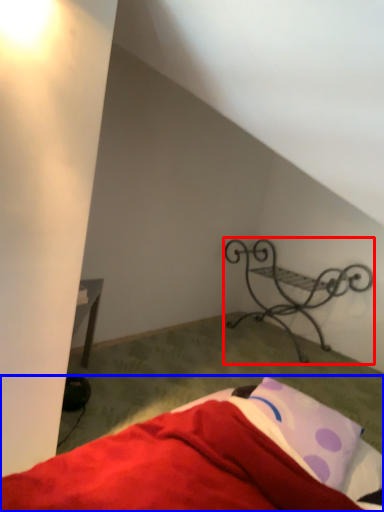
Question: Which point is further to the camera, furniture (highlighted by a red box) or bed (highlighted by a blue box)?

Choices:
 (A) furniture
 (B) bed

Answer: (A)